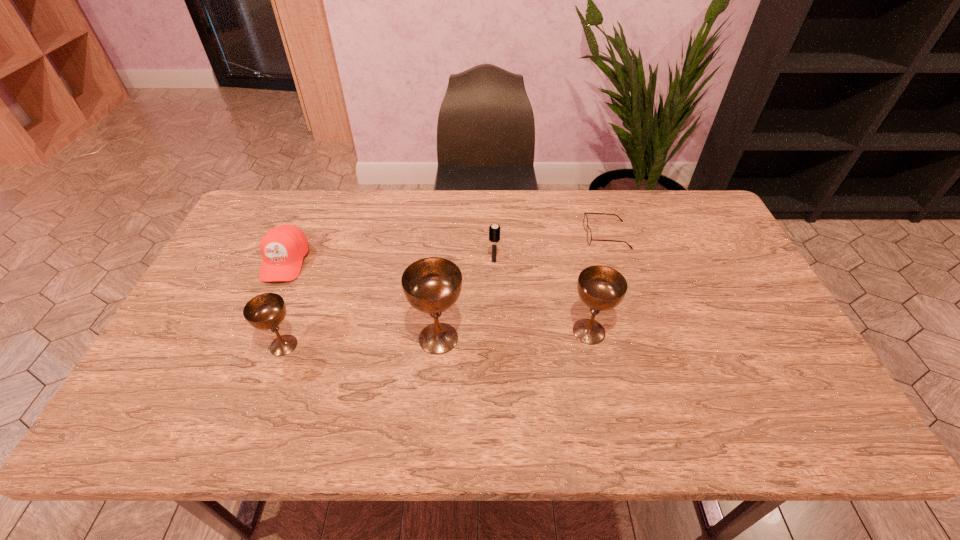
Identify the location of free space at the left edge of the desktop. (221, 300).

Where is `vacant area at the right edge`? vacant area at the right edge is located at coordinates tap(697, 261).

This screenshot has width=960, height=540. I want to click on free space at the far right corner of the desktop, so click(x=696, y=214).

This screenshot has width=960, height=540. I want to click on free spot between the fourth object from left to right and the spectacles, so click(x=550, y=248).

Locate an element on the screen. The image size is (960, 540). free spot between the second shortest object and the hairbrush is located at coordinates (390, 261).

Where is `blank region between the hairbrush and the spectacles`? The width and height of the screenshot is (960, 540). blank region between the hairbrush and the spectacles is located at coordinates (550, 248).

This screenshot has height=540, width=960. In order to click on free spot between the spectacles and the second chalice from right to left in this screenshot , I will do `click(522, 287)`.

In order to click on blank region between the shortest chalice and the hairbrush in this screenshot , I will do `click(389, 303)`.

Where is `vacant area that lies between the shortest object and the tallest object`? vacant area that lies between the shortest object and the tallest object is located at coordinates (522, 287).

Where is `free point between the third object from right to left and the spectacles`? free point between the third object from right to left and the spectacles is located at coordinates (550, 248).